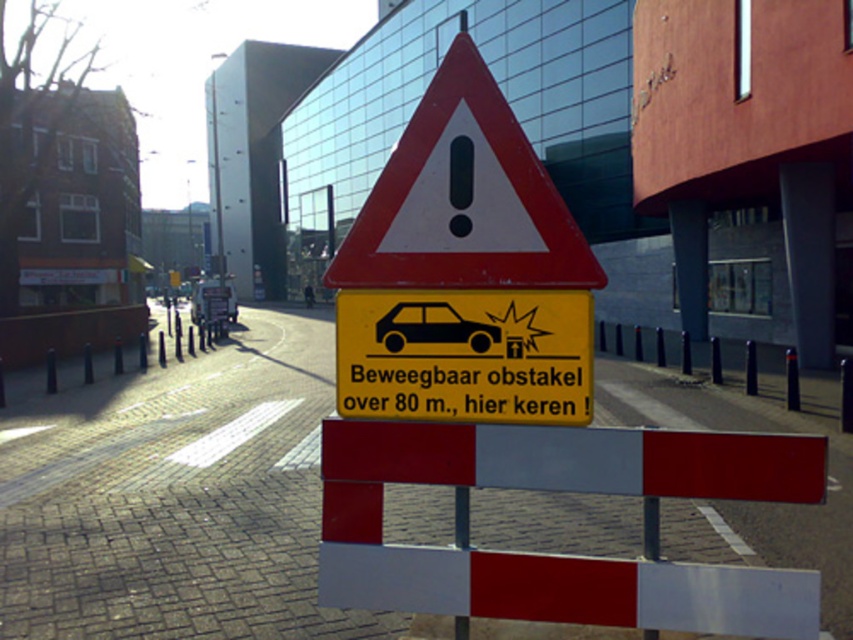
Question: Can you confirm if red plastic barrier at center is positioned above black glossy car at center?

Choices:
 (A) no
 (B) yes

Answer: (A)

Question: Does red reflective triangle at center appear on the right side of black glossy car at center?

Choices:
 (A) no
 (B) yes

Answer: (B)

Question: Based on their relative distances, which object is farther from the yellow paper sign at center?

Choices:
 (A) reflective plastic barrier at center
 (B) red plastic barrier at center
 (C) red reflective triangle at center

Answer: (B)

Question: Which point is closer to the camera taking this photo?

Choices:
 (A) (613, 484)
 (B) (386, 336)
 (C) (378, 314)

Answer: (A)

Question: Observing the image, what is the correct spatial positioning of yellow paper sign at center in reference to black glossy car at center?

Choices:
 (A) above
 (B) below

Answer: (B)

Question: Which point appears farthest from the camera in this image?

Choices:
 (A) (622, 355)
 (B) (468, 324)
 (C) (373, 404)

Answer: (A)